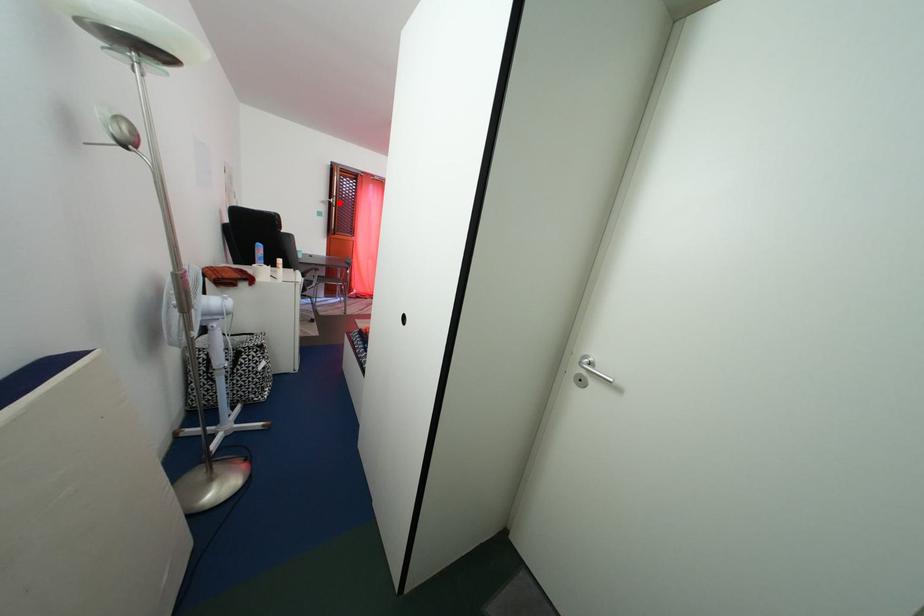
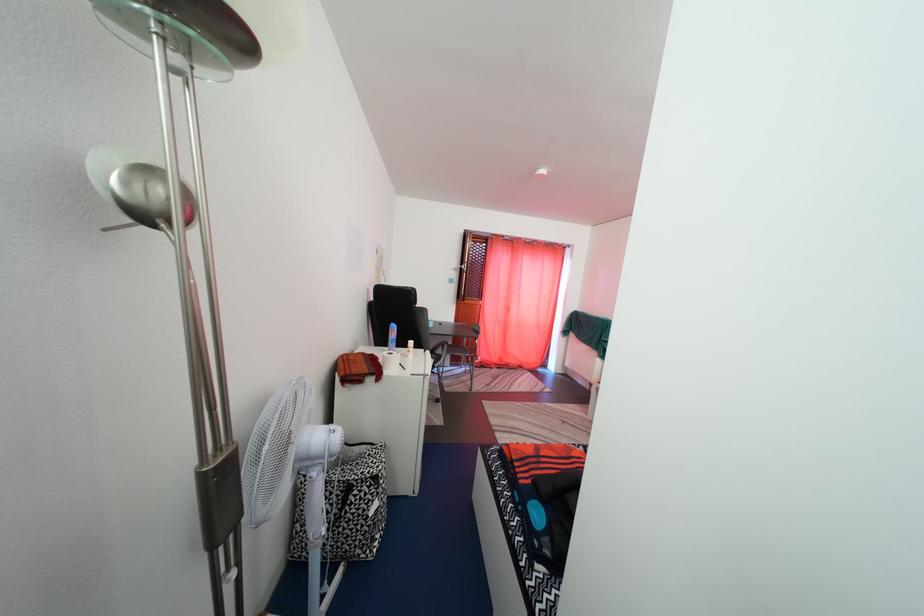
Locate, in the second image, the point that corresponds to the highlighted location in the first image.

(470, 270)